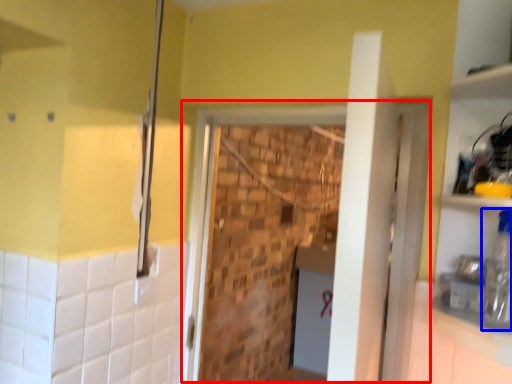
Question: Among these objects, which one is nearest to the camera, screen door (highlighted by a red box) or bottle (highlighted by a blue box)?

Choices:
 (A) screen door
 (B) bottle

Answer: (B)